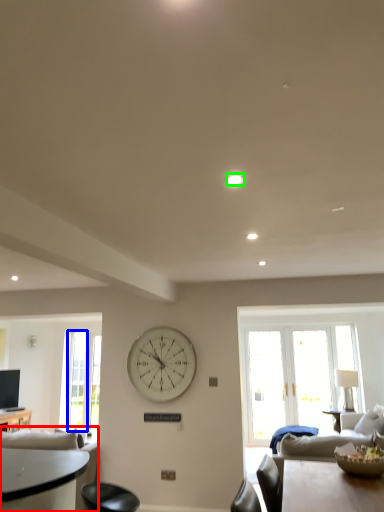
Question: Based on their relative distances, which object is nearer to studio couch (highlighted by a red box)? Choose from glass door (highlighted by a blue box) and light (highlighted by a green box).

Choices:
 (A) glass door
 (B) light

Answer: (B)